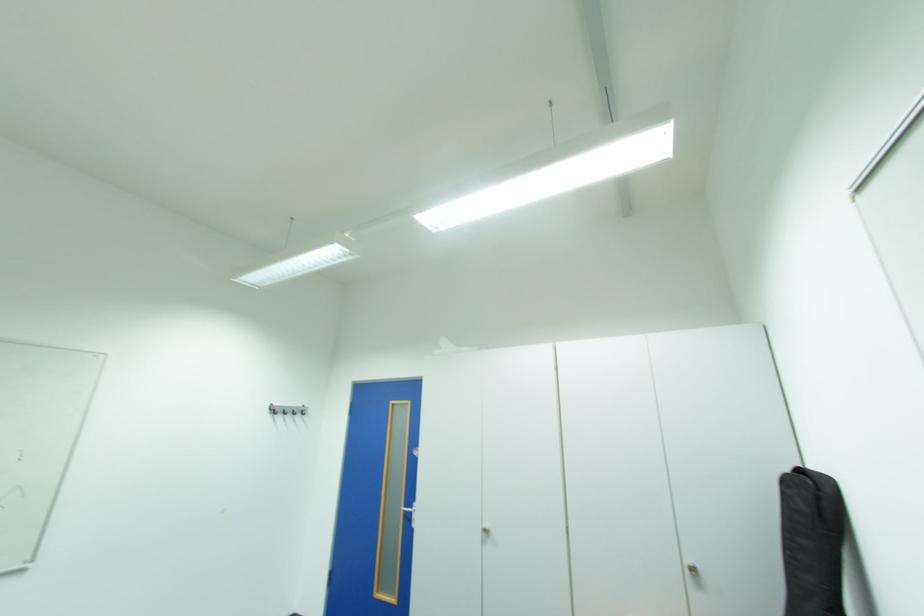
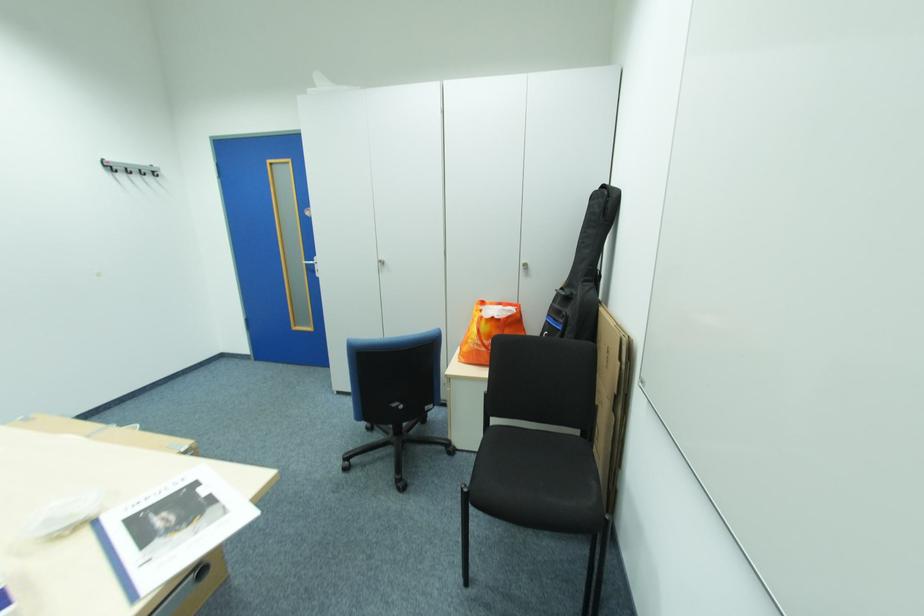
How did the camera likely rotate?

The camera's rotation is toward right-down.